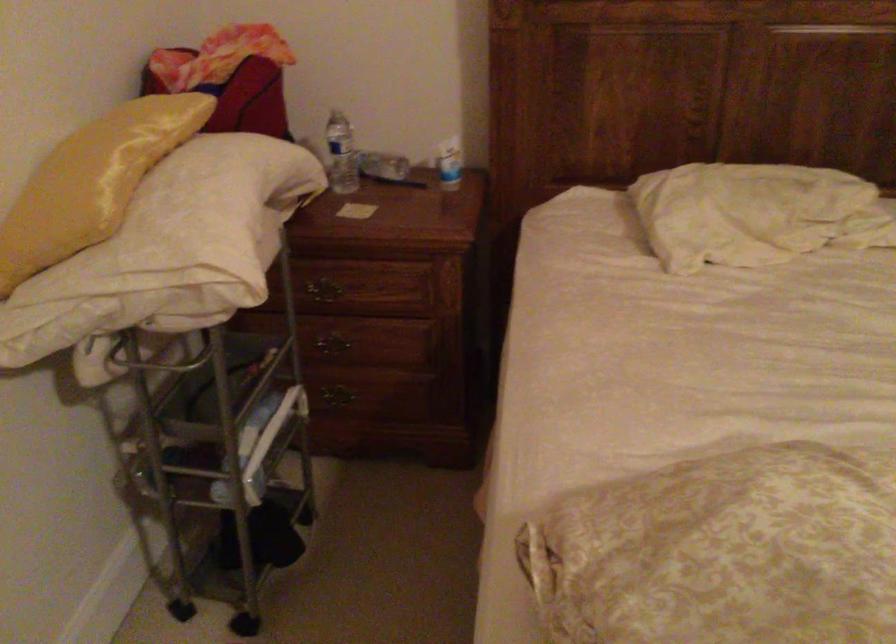
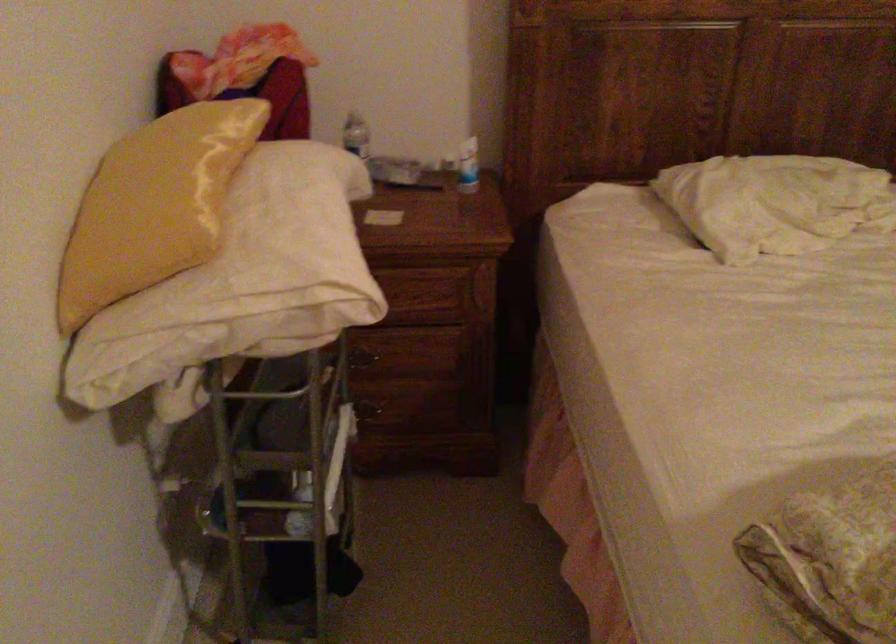
Find the pixel in the second image that matches (148,251) in the first image.

(254, 272)